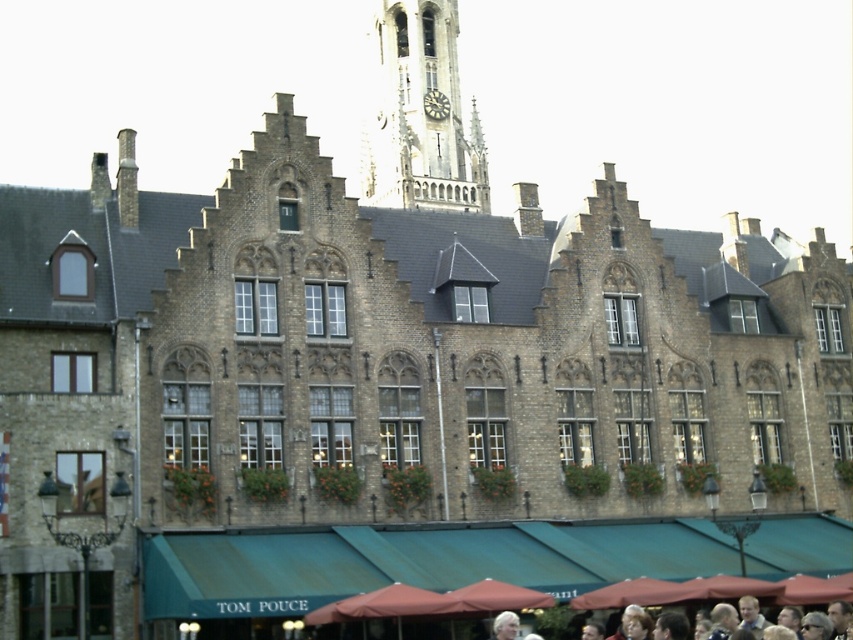
Can you confirm if stone clock tower at upper center is bigger than dark gray stone clock at center?

Yes.

Is point (445, 122) positioned behind point (437, 100)?

No.

You are a GUI agent. You are given a task and a screenshot of the screen. Output one action in this format:
    pyautogui.click(x=<x>, y=<y>)
    Task: Click on the stone clock tower at upper center
    
    Given the screenshot: What is the action you would take?
    pyautogui.click(x=421, y=115)